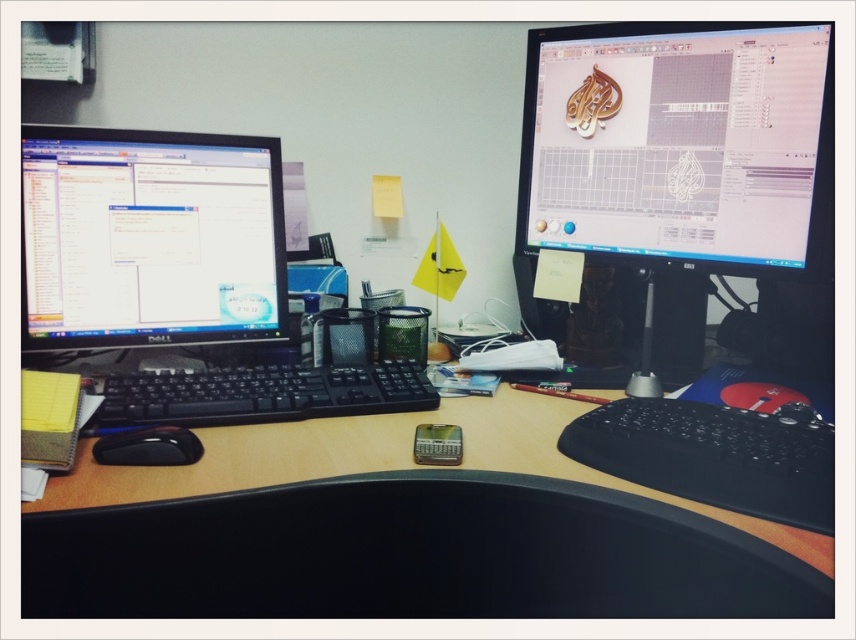
In the scene shown: You are setting up a new monitor on your desk. You have a matte black monitor at upper right and a black plastic keyboard at center. Which object is larger in size?

The matte black monitor at upper right is bigger than the black plastic keyboard at center.

What is located at the point with coordinates (x=675, y=163) in the workspace setup?

The point at coordinates (x=675, y=163) is on the matte black monitor at upper right.

You are setting up a new webcam for a video call and need to place it on the tallest object available. Which object should you choose between the matte black monitor at upper right and the black plastic keyboard at center?

The matte black monitor at upper right is much taller than the black plastic keyboard at center, so you should place the webcam on the matte black monitor at upper right.